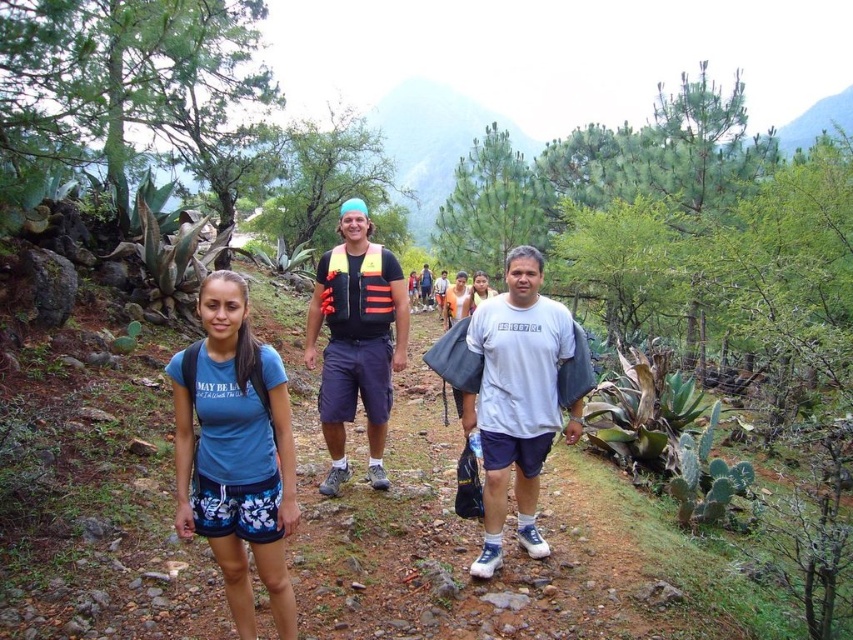
Question: Is the position of white matte t-shirt at center less distant than that of white cotton shirt at center?

Choices:
 (A) no
 (B) yes

Answer: (B)

Question: Which point is farther from the camera taking this photo?

Choices:
 (A) (357, 216)
 (B) (480, 284)
 (C) (550, 355)

Answer: (B)

Question: Does blue fabric shorts at lower left appear on the left side of orange life vest at center?

Choices:
 (A) yes
 (B) no

Answer: (A)

Question: Which object is positioned farthest from the white matte t-shirt at center?

Choices:
 (A) orange mesh life vest at center
 (B) blue fabric shorts at lower left

Answer: (B)

Question: Observing the image, what is the correct spatial positioning of orange mesh life vest at center in reference to white cotton shirt at center?

Choices:
 (A) right
 (B) left

Answer: (B)

Question: Which of these objects is positioned farthest from the white cotton shirt at center?

Choices:
 (A) blue fabric shorts at lower left
 (B) white matte t-shirt at center
 (C) orange life vest at center

Answer: (A)